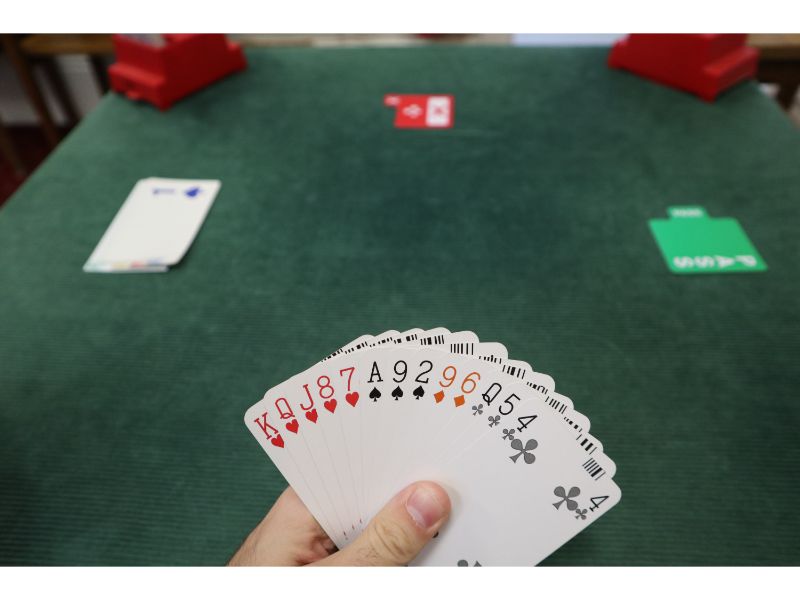
Find the location of `playing table`. playing table is located at coordinates coord(426,242).